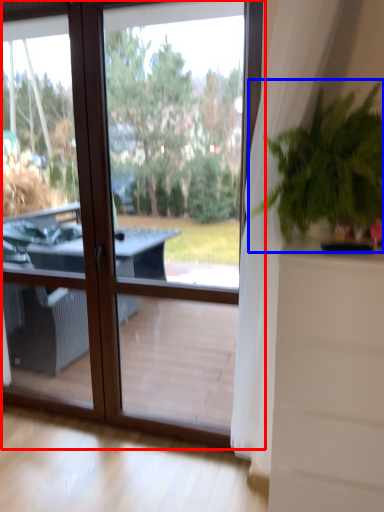
Question: Among these objects, which one is nearest to the camera, window (highlighted by a red box) or houseplant (highlighted by a blue box)?

Choices:
 (A) window
 (B) houseplant

Answer: (B)